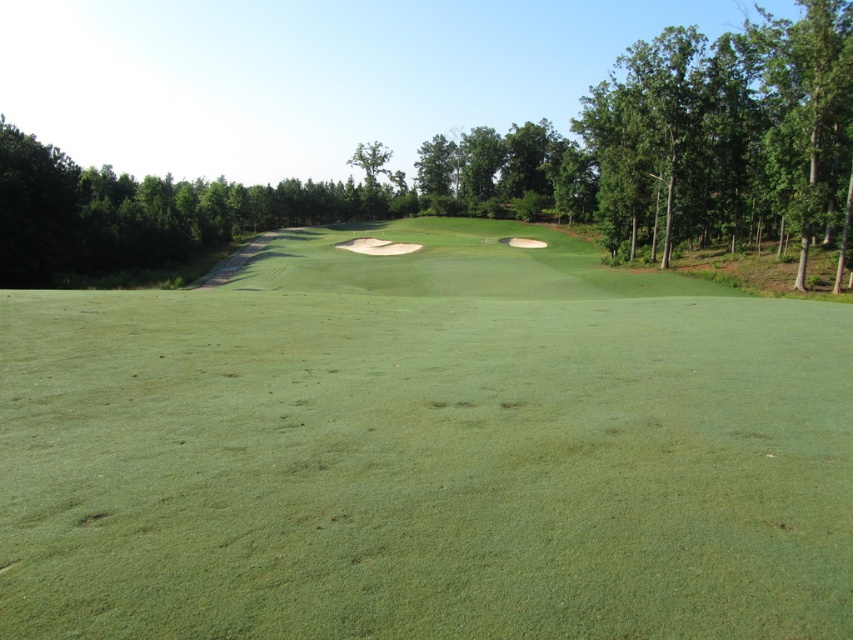
Based on the photo, you are a golfer standing at the tee and looking towards the green. You notice two points marked on the fairway. The first point is at coordinates point (628, 280) and the second point is at point (830, 118). Which point is closer to your current position?

Point (628, 280) is further to the camera than point (830, 118). Therefore, the point closer to your current position is point (830, 118) since it is nearer to the camera compared to point (628, 280).

You are a golfer standing on the green grassy golf course at center. You want to hit a ball towards the green leafy tree at center. Which direction should you aim to reach the tree?

The green grassy golf course at center is located below the green leafy tree at center, so you should aim upwards to reach the tree.

You are a golfer standing on the green grassy golf course at center and want to hit the ball towards the green leafy tree at center. Since both are green, how can you tell them apart based on their size?

The green grassy golf course at center is thinner than the green leafy tree at center, so the golf course area appears narrower in width compared to the tree.